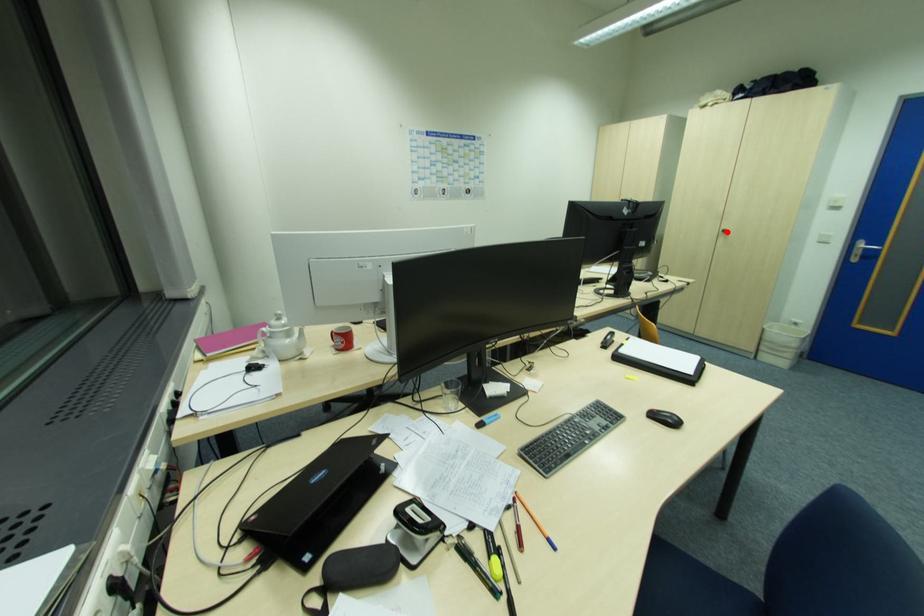
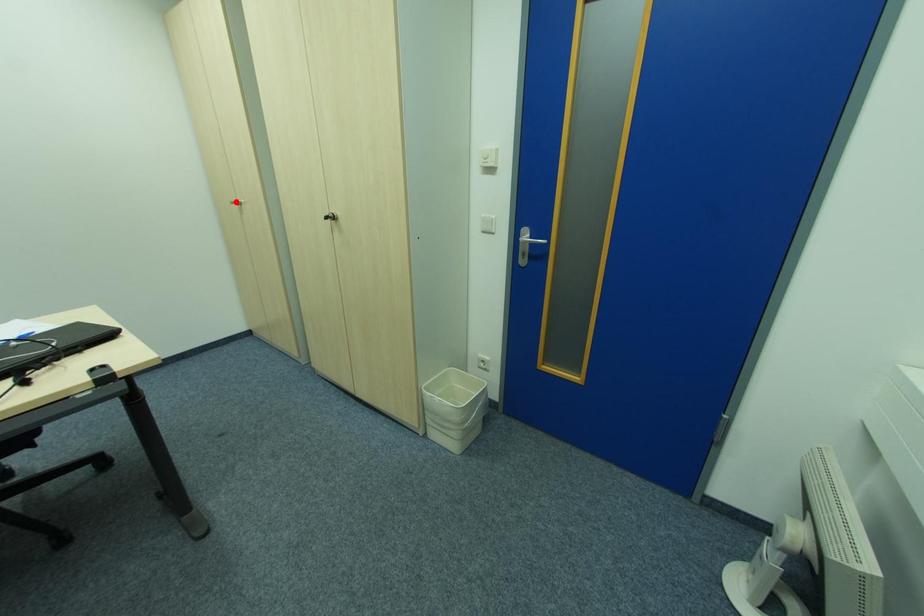
I am providing you with two images of the same scene from different viewpoints. A red point is marked on the first image and another point is marked on the second image. Do the highlighted points in image1 and image2 indicate the same real-world spot?

No